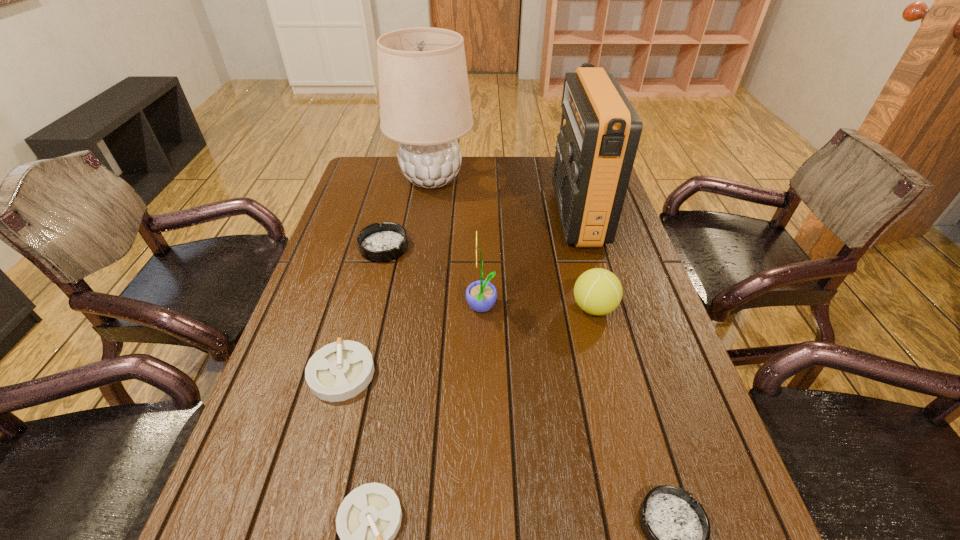
Where is `vacant space located on the front-facing side of the radio receiver`? vacant space located on the front-facing side of the radio receiver is located at coordinates (465, 215).

This screenshot has height=540, width=960. What are the coordinates of `vacant area situated on the front-facing side of the radio receiver` in the screenshot? It's located at (437, 215).

Locate an element on the screen. The height and width of the screenshot is (540, 960). blank space located 0.160m on the front-facing side of the radio receiver is located at coordinates (506, 215).

I want to click on vacant space located 0.210m on the front-facing side of the sunflower, so click(383, 309).

Locate an element on the screen. The height and width of the screenshot is (540, 960). free location located on the front-facing side of the sunflower is located at coordinates (340, 309).

The height and width of the screenshot is (540, 960). In order to click on vacant space located on the front-facing side of the sunflower in this screenshot , I will do `click(359, 309)`.

Locate an element on the screen. This screenshot has height=540, width=960. vacant region located on the left of the fifth shortest object is located at coordinates (449, 308).

In order to click on free location located 0.380m on the front of the left dark ashtray in this screenshot , I will do `click(351, 377)`.

Locate an element on the screen. free space located on the front of the third nearest ashtray is located at coordinates (300, 528).

The image size is (960, 540). What are the coordinates of `lampshade situated at the far edge` in the screenshot? It's located at (425, 105).